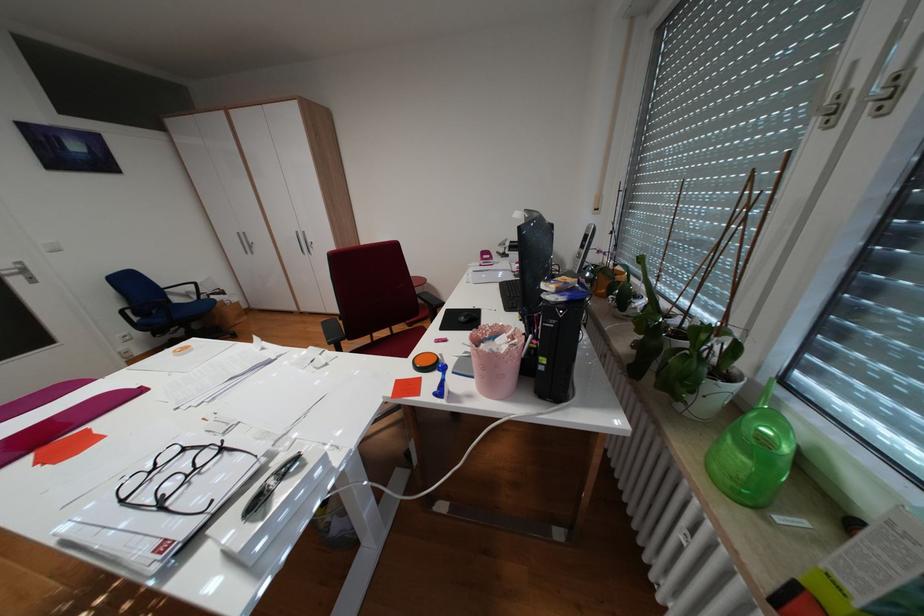
What do you see at coordinates (14, 268) in the screenshot? I see `the silver door handle` at bounding box center [14, 268].